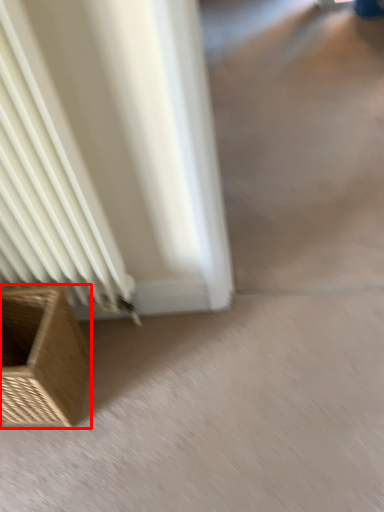
Question: From the image's perspective, considering the relative positions of furniture (annotated by the red box) and concrete in the image provided, where is furniture (annotated by the red box) located with respect to the staircase?

Choices:
 (A) below
 (B) above

Answer: (B)